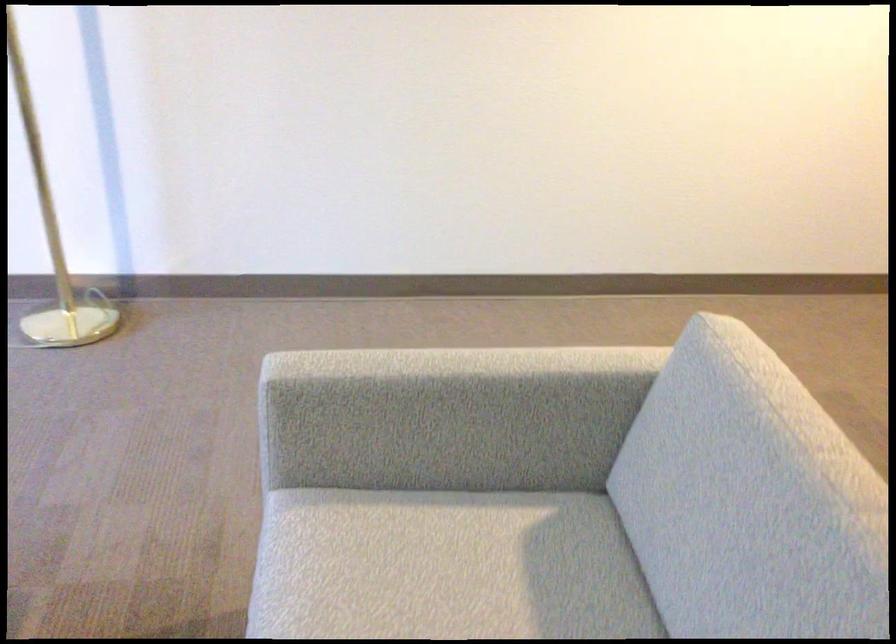
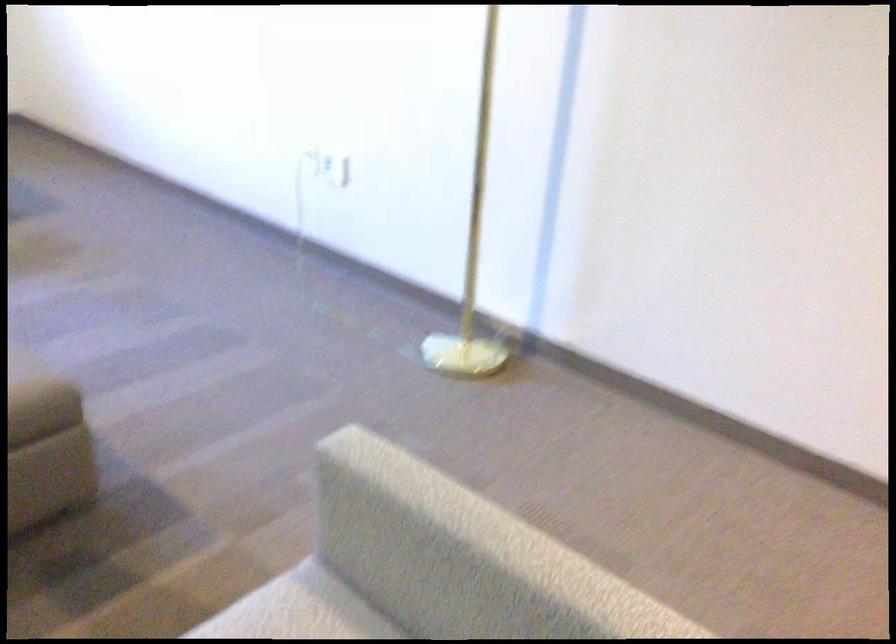
The point at (x=368, y=368) is marked in the first image. Where is the corresponding point in the second image?

(421, 489)